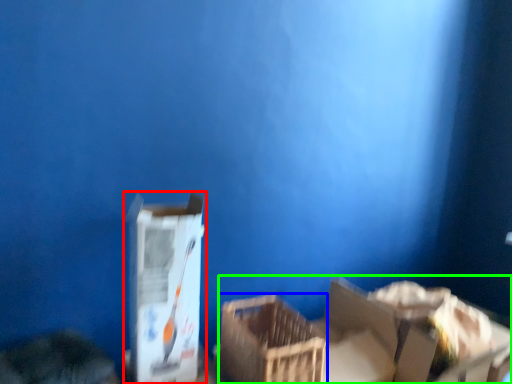
Question: Estimate the real-world distances between objects in this image. Which object is closer to box (highlighted by a red box), crate (highlighted by a blue box) or storage box (highlighted by a green box)?

Choices:
 (A) crate
 (B) storage box

Answer: (A)